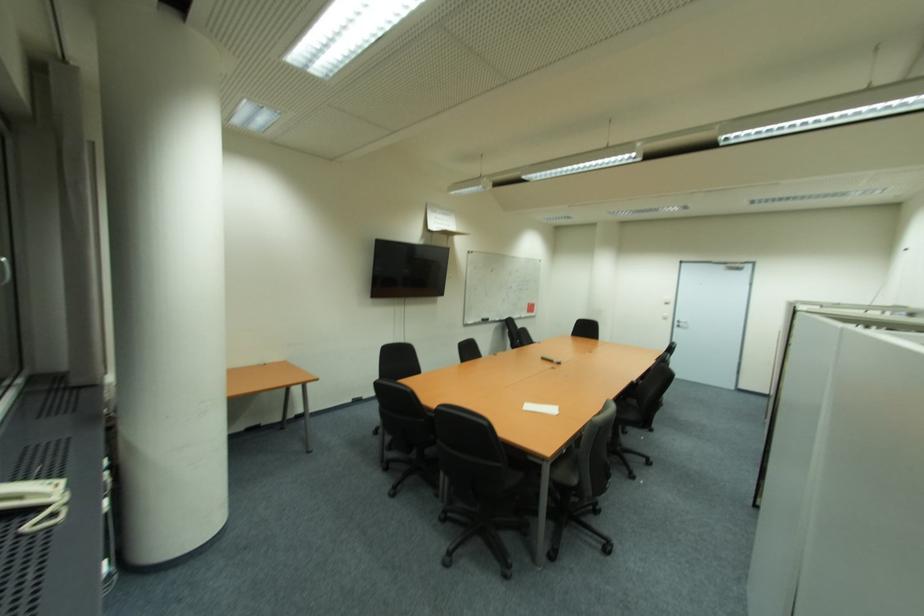
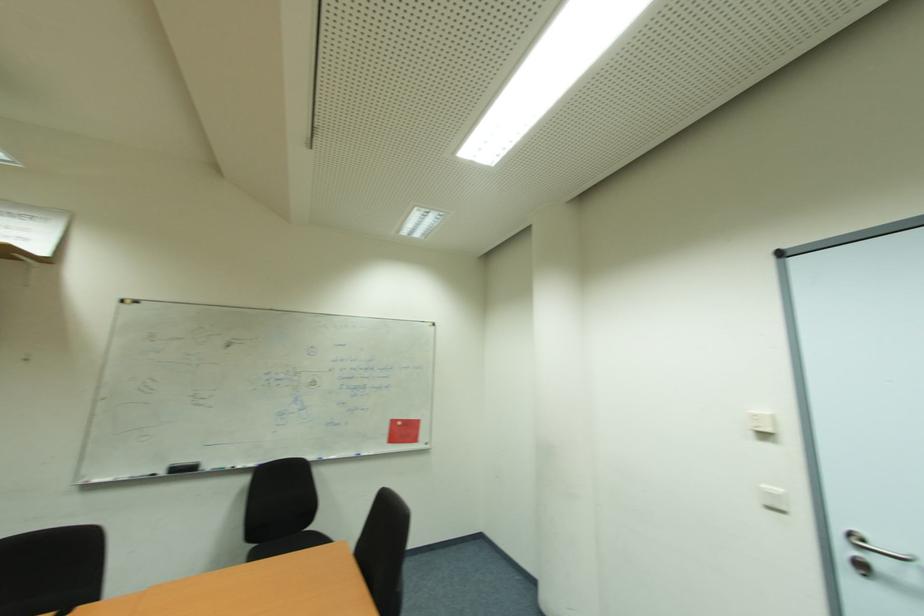
Locate, in the second image, the point that corresponds to point (489, 321) in the first image.

(189, 469)